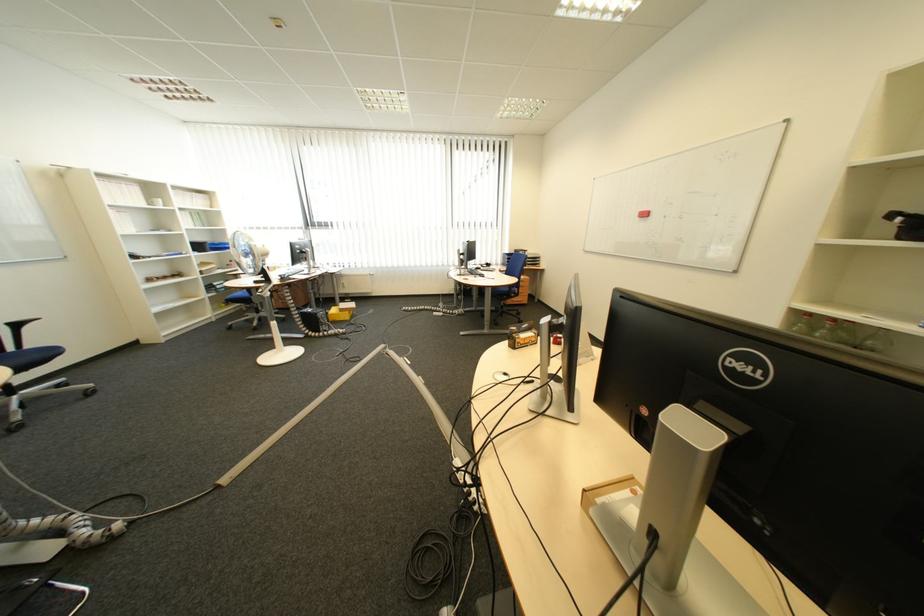
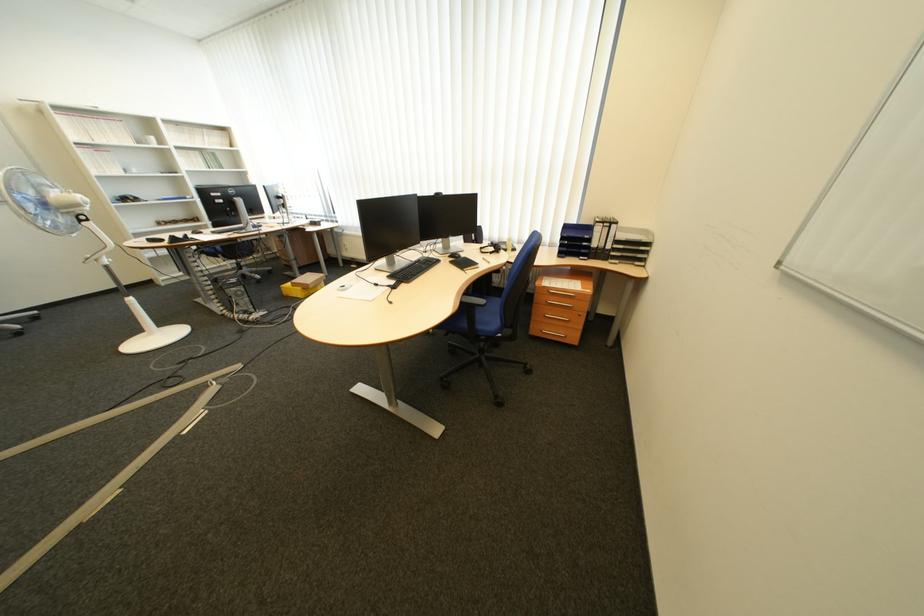
In the second image, find the point that corresponds to point (526, 254) in the first image.

(604, 225)